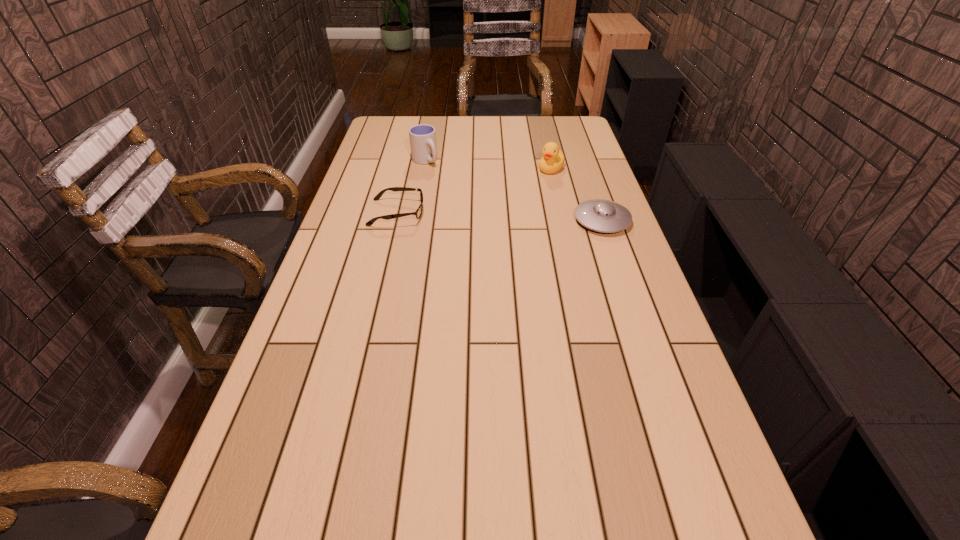
Where is `blank area located on the face of the duckling`? The image size is (960, 540). blank area located on the face of the duckling is located at coordinates (515, 199).

Locate an element on the screen. The image size is (960, 540). vacant space located on the face of the duckling is located at coordinates (517, 197).

Find the location of a particular element. object that is at the left edge is located at coordinates (418, 213).

Locate an element on the screen. Image resolution: width=960 pixels, height=540 pixels. saucer present at the right edge is located at coordinates (600, 215).

Identify the location of duckling at the right edge. This screenshot has width=960, height=540. (553, 160).

This screenshot has width=960, height=540. Identify the location of blank space at the far edge of the desktop. (535, 137).

In the image, there is a desktop. Find the location of `vacant space at the near edge`. vacant space at the near edge is located at coordinates (600, 501).

Locate an element on the screen. This screenshot has height=540, width=960. free space at the left edge is located at coordinates pos(315,326).

Where is `blank space at the right edge of the desktop`? The height and width of the screenshot is (540, 960). blank space at the right edge of the desktop is located at coordinates (643, 392).

The height and width of the screenshot is (540, 960). What are the coordinates of `vacant area at the far left corner of the desktop` in the screenshot? It's located at (411, 128).